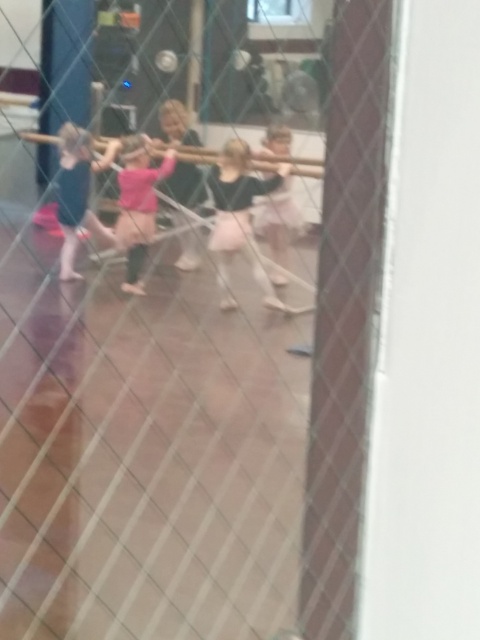
Question: Which of the following is the closest to the observer?

Choices:
 (A) pink satin ballet skirt at center
 (B) matte black ballet skirt at left
 (C) pink satin tutu at center

Answer: (C)

Question: Is matte black ballet skirt at left positioned in front of pink satin ballet skirt at center?

Choices:
 (A) no
 (B) yes

Answer: (A)

Question: Is matte black ballet skirt at left positioned in front of pink satin ballet skirt at center?

Choices:
 (A) yes
 (B) no

Answer: (B)

Question: Which object is positioned closest to the pink matte dress at center?

Choices:
 (A) pink satin ballet skirt at center
 (B) matte black ballet skirt at left
 (C) pink satin tutu at center

Answer: (B)

Question: Which object is positioned farthest from the pink satin tutu at center?

Choices:
 (A) matte black ballet skirt at left
 (B) pink matte dress at center

Answer: (A)

Question: Does pink satin tutu at center have a lesser width compared to matte black ballet skirt at left?

Choices:
 (A) yes
 (B) no

Answer: (B)